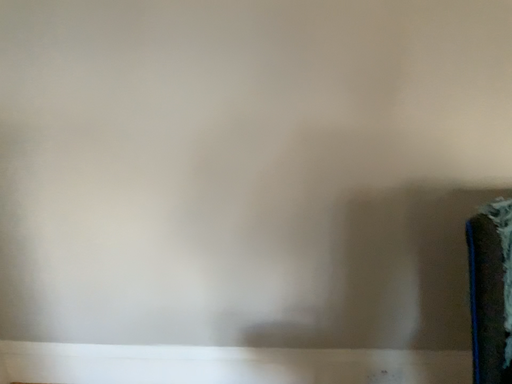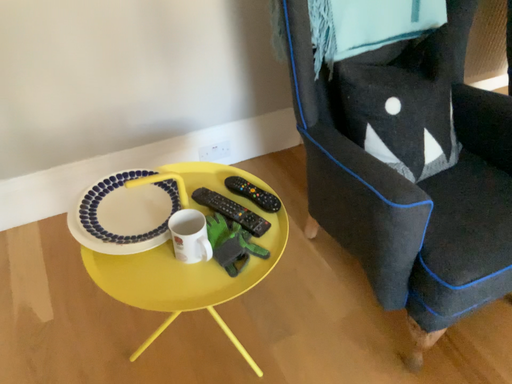
Question: Which way did the camera rotate in the video?

Choices:
 (A) rotated upward
 (B) rotated downward

Answer: (B)